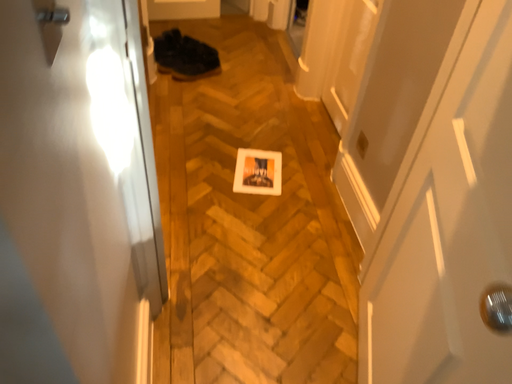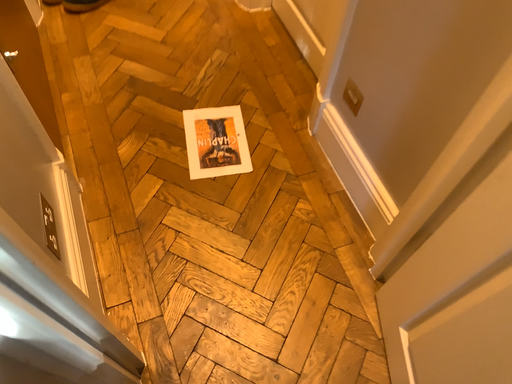
Question: How did the camera likely rotate when shooting the video?

Choices:
 (A) rotated downward
 (B) rotated upward

Answer: (A)